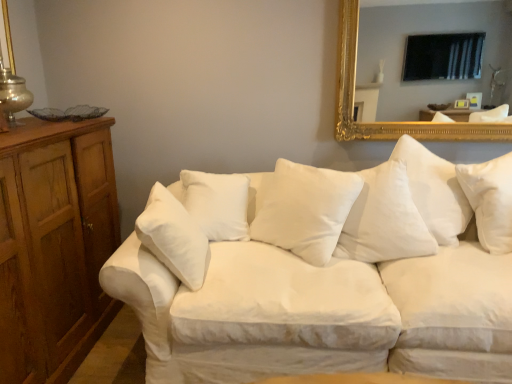
Question: From the image's perspective, relative to white cotton couch at center, is gold-framed mirror at upper right above or below?

Choices:
 (A) above
 (B) below

Answer: (A)

Question: From a real-world perspective, relative to white cotton couch at center, is gold-framed mirror at upper right vertically above or below?

Choices:
 (A) below
 (B) above

Answer: (B)

Question: Which of these objects is positioned closest to the shiny metallic lamp at left?

Choices:
 (A) white cotton couch at center
 (B) gold-framed mirror at upper right
 (C) wooden dresser at left
 (D) white soft cushion at center

Answer: (C)

Question: Estimate the real-world distances between objects in this image. Which object is closer to the gold-framed mirror at upper right?

Choices:
 (A) white soft cushion at center
 (B) white cotton couch at center
 (C) shiny metallic lamp at left
 (D) wooden dresser at left

Answer: (A)